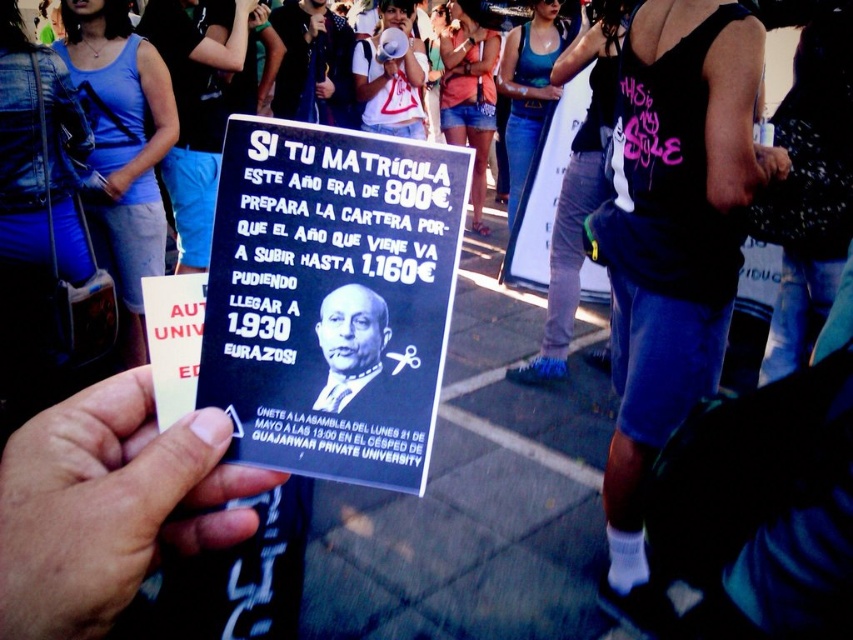
Question: Observing the image, what is the correct spatial positioning of black matte tank top at center in reference to smooth black suit at center?

Choices:
 (A) right
 (B) left

Answer: (A)

Question: Which point is closer to the camera?

Choices:
 (A) black paper poster at center
 (B) smooth black card at center

Answer: (B)

Question: Is black paper poster at center bigger than smooth black card at center?

Choices:
 (A) no
 (B) yes

Answer: (A)

Question: Which object appears closest to the camera in this image?

Choices:
 (A) black matte tank top at center
 (B) black paper poster at center

Answer: (B)

Question: Which point is closer to the camera?

Choices:
 (A) black paper poster at center
 (B) black matte tank top at center
 (C) smooth black card at center
 (D) smooth black suit at center

Answer: (C)

Question: Observing the image, what is the correct spatial positioning of black paper poster at center in reference to smooth black card at center?

Choices:
 (A) right
 (B) left

Answer: (A)